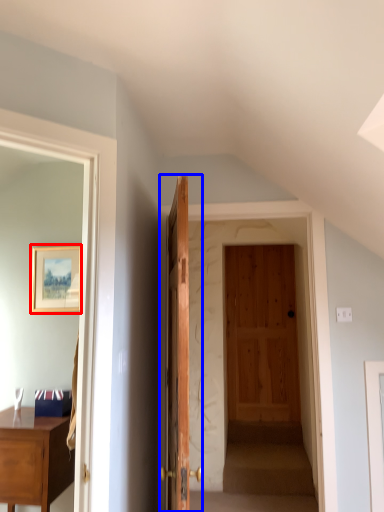
Question: Which object appears farthest to the camera in this image, picture frame (highlighted by a red box) or door (highlighted by a blue box)?

Choices:
 (A) picture frame
 (B) door

Answer: (A)